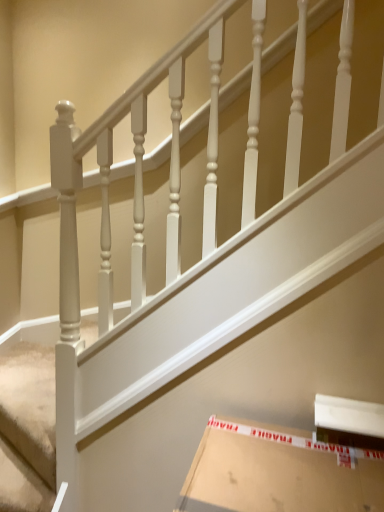
Question: Is white textured carpet at lower left a part of white cardboard box at lower right?

Choices:
 (A) yes
 (B) no

Answer: (B)

Question: Is white cardboard box at lower right facing away from white textured carpet at lower left?

Choices:
 (A) no
 (B) yes

Answer: (A)

Question: Can we say white cardboard box at lower right lies outside white textured carpet at lower left?

Choices:
 (A) no
 (B) yes

Answer: (B)

Question: Is white cardboard box at lower right positioned in front of white textured carpet at lower left?

Choices:
 (A) yes
 (B) no

Answer: (A)

Question: From a real-world perspective, is white cardboard box at lower right on white textured carpet at lower left?

Choices:
 (A) yes
 (B) no

Answer: (A)

Question: From the image's perspective, is white cardboard box at lower right on top of white textured carpet at lower left?

Choices:
 (A) yes
 (B) no

Answer: (B)

Question: Is white textured carpet at lower left shorter than white cardboard box at lower right?

Choices:
 (A) yes
 (B) no

Answer: (A)

Question: Are white textured carpet at lower left and white cardboard box at lower right beside each other?

Choices:
 (A) no
 (B) yes

Answer: (A)

Question: From a real-world perspective, is white textured carpet at lower left located higher than white cardboard box at lower right?

Choices:
 (A) no
 (B) yes

Answer: (A)

Question: Is white cardboard box at lower right at the back of white textured carpet at lower left?

Choices:
 (A) yes
 (B) no

Answer: (B)

Question: Considering the relative positions of white textured carpet at lower left and white cardboard box at lower right in the image provided, is white textured carpet at lower left to the left of white cardboard box at lower right from the viewer's perspective?

Choices:
 (A) yes
 (B) no

Answer: (A)

Question: Does white textured carpet at lower left turn towards white cardboard box at lower right?

Choices:
 (A) no
 (B) yes

Answer: (A)

Question: From a real-world perspective, relative to white textured carpet at lower left, is white cardboard box at lower right vertically above or below?

Choices:
 (A) above
 (B) below

Answer: (A)